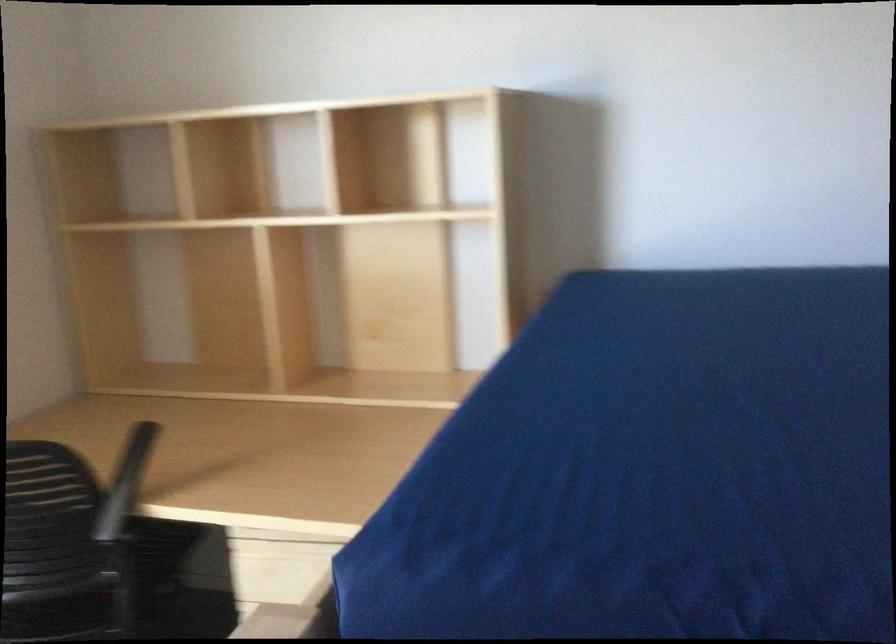
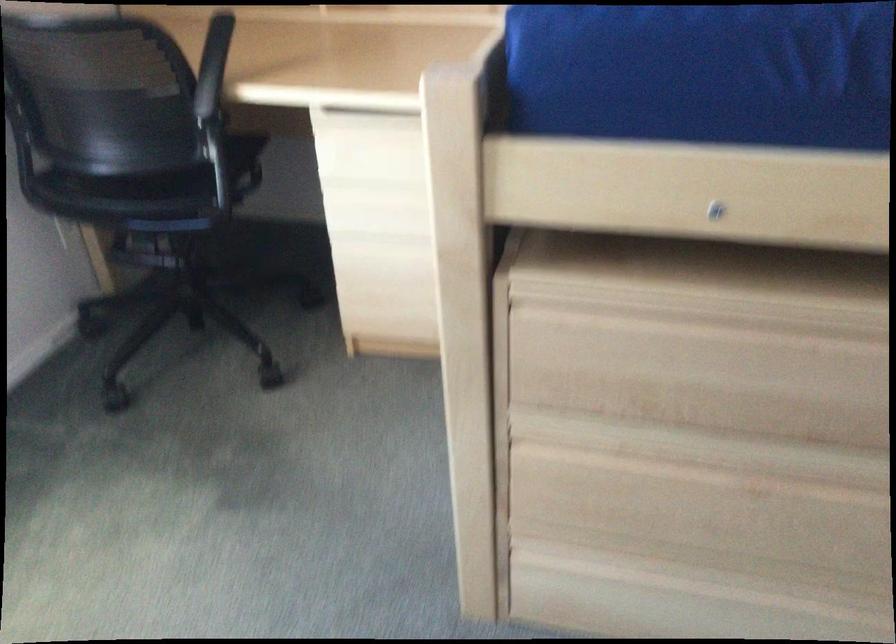
Question: How did the camera likely rotate?

Choices:
 (A) Left
 (B) Right
 (C) Up
 (D) Down

Answer: (D)